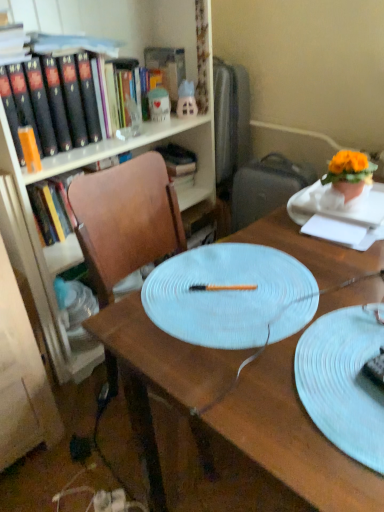
Question: Is matte white ceramic mug at upper center, the first toy positioned from the left, to the left or to the right of chocolate cake at center in the image?

Choices:
 (A) right
 (B) left

Answer: (B)

Question: Is point (152, 114) closer or farther from the camera than point (380, 361)?

Choices:
 (A) farther
 (B) closer

Answer: (A)

Question: Which object is the farthest from the wooden desk at center?

Choices:
 (A) chocolate cake at center
 (B) orange matte book at left, positioned as the 1th book in front-to-back order
 (C) white glossy house at upper center, positioned as the first toy in right-to-left order
 (D) white paper at upper right
 (E) matte wood bookcase at upper left

Answer: (C)

Question: Estimate the real-world distances between objects in this image. Which object is closer to the white textured plate at center?

Choices:
 (A) orange matte flower pot at upper right
 (B) white glossy house at upper center, positioned as the first toy in right-to-left order
 (C) wooden chair at center
 (D) matte wood bookcase at upper left
 (E) hardcover book at center, the 1th book from the back

Answer: (A)